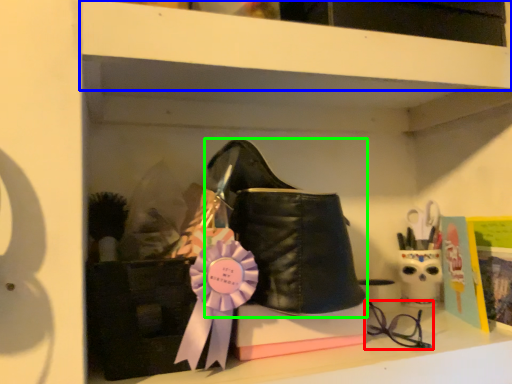
Question: Estimate the real-world distances between objects in this image. Which object is closer to glasses (highlighted by a red box), shelf (highlighted by a blue box) or footwear (highlighted by a green box)?

Choices:
 (A) shelf
 (B) footwear

Answer: (B)